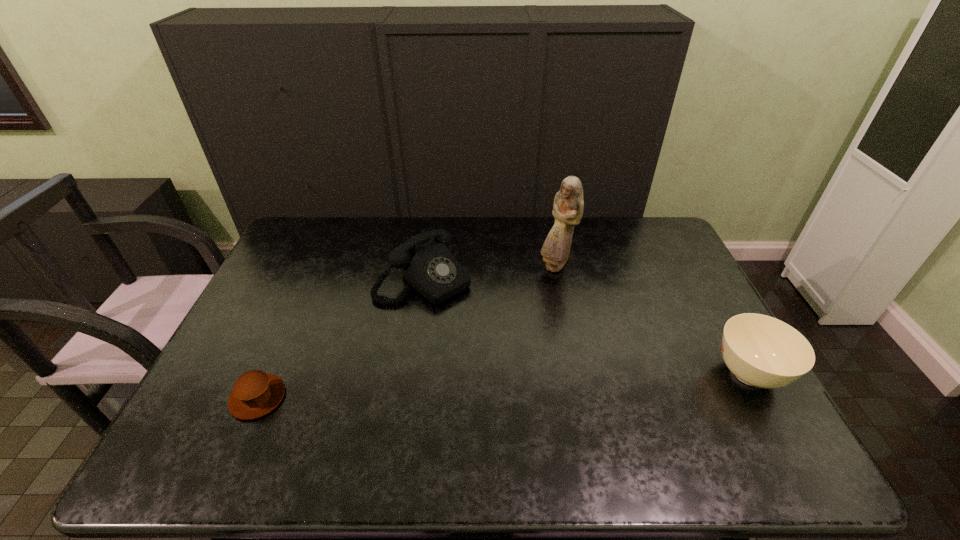
I want to click on vacant space on the desktop that is between the leftmost object and the sugar bowl and is positioned on the front-facing side of the third object from left to right, so click(555, 383).

At what (x,y) coordinates should I click in order to perform the action: click on free space on the desktop that is between the shortest object and the rightmost object and is positioned on the dial of the third object from right to left. Please return your answer as a coordinate pair (x, y). Looking at the image, I should click on pyautogui.click(x=540, y=384).